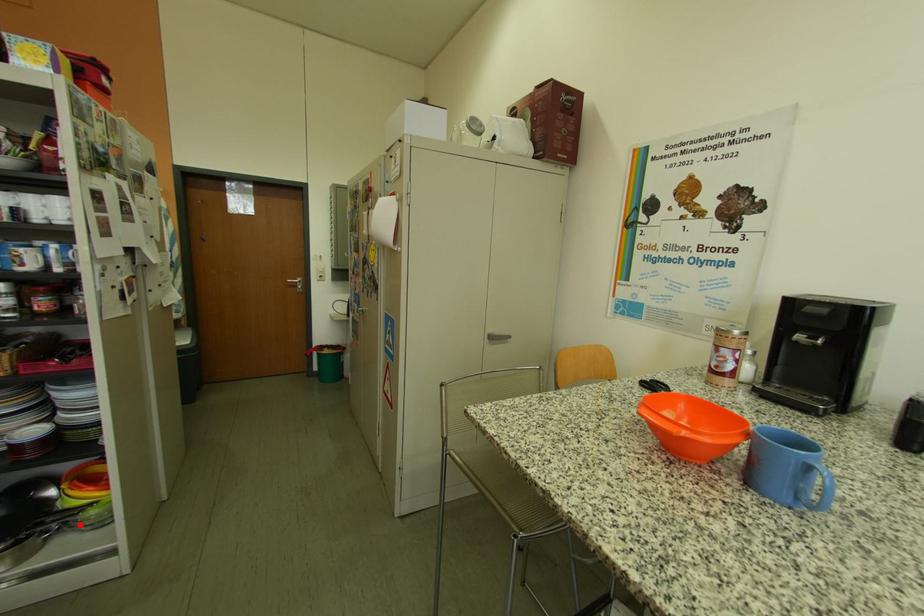
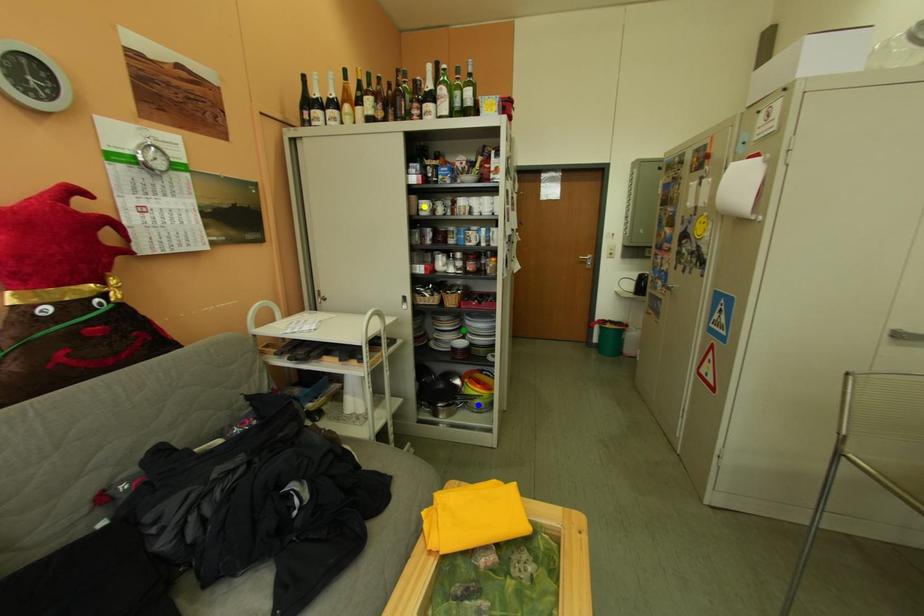
Question: I am providing you with two images of the same scene from different viewpoints. A red point is marked on the first image. You are given multiple points on the second image. Can you choose the point in image 2 that corresponds to the point in image 1?

Choices:
 (A) yellow point
 (B) blue point
 (C) green point

Answer: (B)